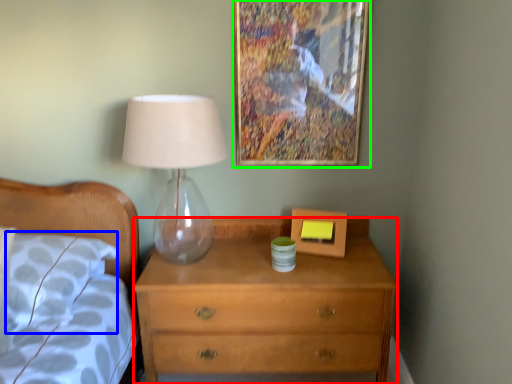
Question: Considering the real-world distances, which object is closest to chest of drawers (highlighted by a red box)? pillow (highlighted by a blue box) or picture frame (highlighted by a green box).

Choices:
 (A) pillow
 (B) picture frame

Answer: (A)